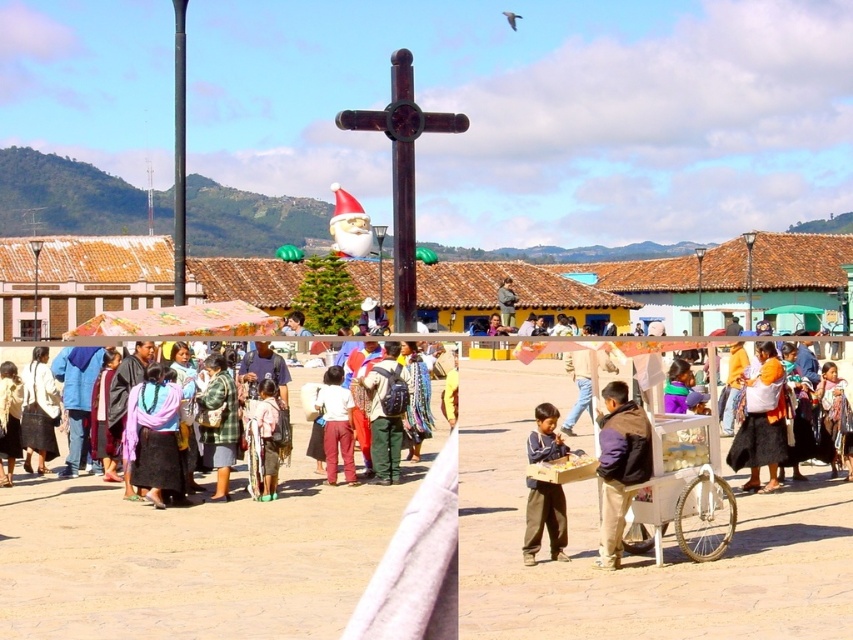
You are a photographer standing on a balcony overlooking the town square. You notice two people in the crowd below wearing dark brown pants at center and matte pink pants at center. Which person would appear shorter in your photo?

The dark brown pants at center would appear shorter in the photo because the dark brown pants at center is not as tall as matte pink pants at center.